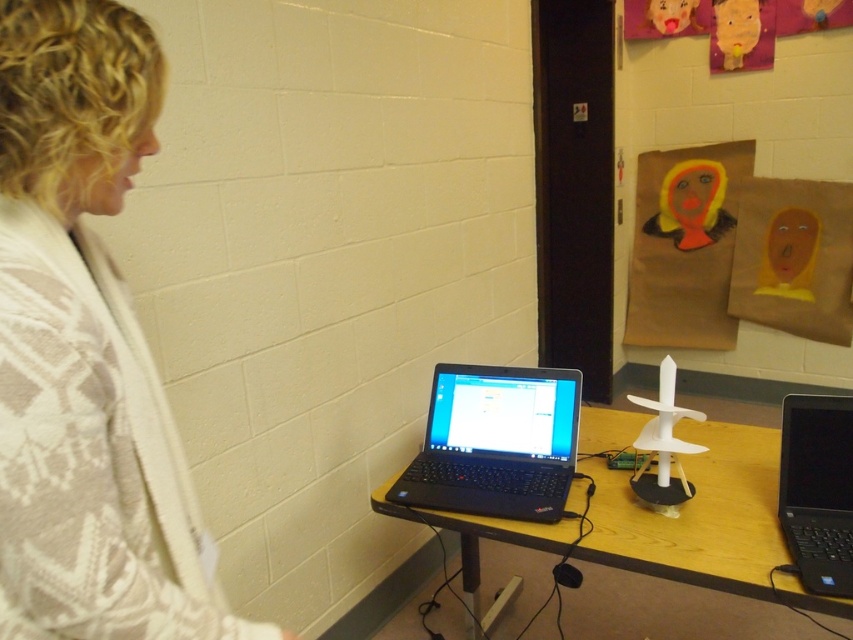
You are a photographer standing at the camera position. You want to take a closeup shot of the black matte laptop at center. Can you reach it without moving your feet? Assume your arm can extend 1.4 meters.

The black matte laptop at center is 1.51 meters away from the camera. Since your arm can only extend 1.4 meters, you cannot reach it without moving your feet.

You are standing in the classroom and need to place a 12cm tall book on the wooden table at center. Is there enough space for it?

The wooden table at center has sufficient space to accommodate a 12cm tall book since the object description does not indicate any size constraints or overcrowding on the table.

You are a student sitting at a desk in a classroom and need to reach both the black matte laptop at center and the black plastic laptop at right. Which one will you have to reach further to get?

You will have to reach further to get the black plastic laptop at right because it is positioned farther away from you compared to the black matte laptop at center, which is closer.